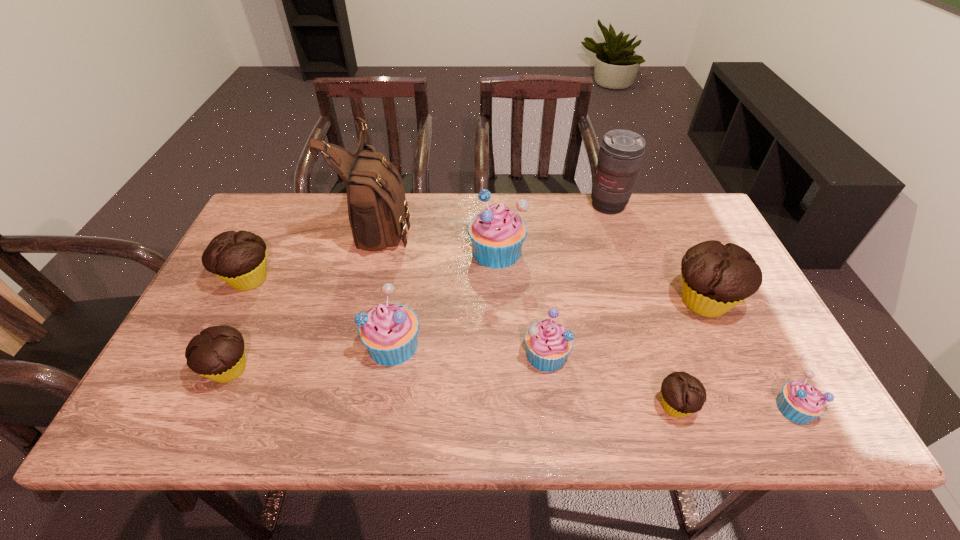
Image resolution: width=960 pixels, height=540 pixels. Identify the location of free space at the right edge. (682, 256).

This screenshot has height=540, width=960. In order to click on free location at the far left corner of the desktop in this screenshot , I will do `click(282, 233)`.

Locate an element on the screen. vacant space at the near left corner of the desktop is located at coordinates (158, 407).

Find the location of a particular element. The height and width of the screenshot is (540, 960). vacant area that lies between the tallest object and the second biggest chocolate muffin is located at coordinates (315, 252).

The height and width of the screenshot is (540, 960). In order to click on free space between the second smallest blue muffin and the brown shoulder bag in this screenshot , I will do [x=464, y=289].

Where is `empty space that is in between the tallest object and the second chocolate muffin from right to left`? empty space that is in between the tallest object and the second chocolate muffin from right to left is located at coordinates (528, 315).

Image resolution: width=960 pixels, height=540 pixels. Find the location of `vacant area between the second smallest blue muffin and the biggest blue muffin`. vacant area between the second smallest blue muffin and the biggest blue muffin is located at coordinates (521, 303).

The width and height of the screenshot is (960, 540). Find the location of `free space that is in between the third biggest blue muffin and the biggest chocolate muffin`. free space that is in between the third biggest blue muffin and the biggest chocolate muffin is located at coordinates (625, 328).

In order to click on empty space that is in between the tallest object and the third biggest chocolate muffin in this screenshot , I will do `click(305, 297)`.

You are a GUI agent. You are given a task and a screenshot of the screen. Output one action in this format:
    pyautogui.click(x=<x>, y=<y>)
    Task: Click on the vacant area that lies between the nearest blue muffin and the shoulder bag
    The image size is (960, 540).
    Given the screenshot: What is the action you would take?
    pyautogui.click(x=588, y=316)